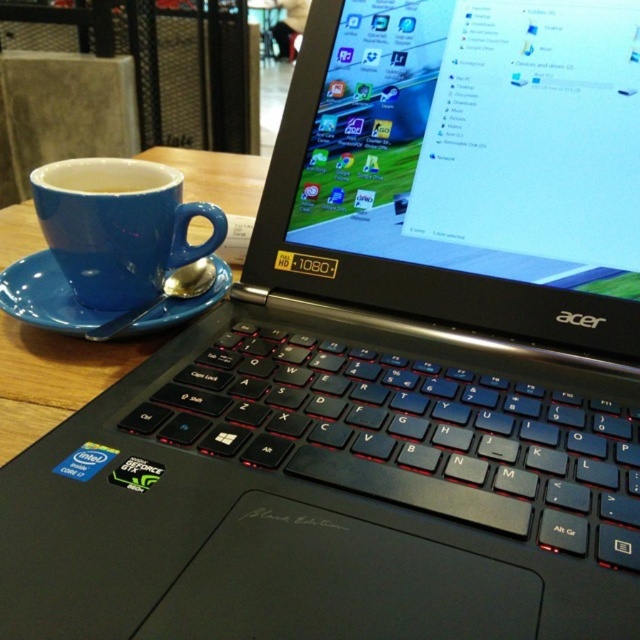
You are setting up a presentation and need to ensure your laptop is centered on the table. The laptop is currently positioned to the right of the matte blue mug at left. Based on the coordinates provided in the description, can you determine if the laptop is centered relative to the table?

The matte blue mug at left is located at point (118, 227). Since the laptop is positioned to the right of the mug, it is not centered on the table as the mug is closer to the left edge of the table. Therefore, the laptop is likely off to the right side and not centered.

You are organizing a small table for a meeting. You have a blue ceramic cup at left and a blue matte saucer at left. Which item is taller?

The blue ceramic cup at left is much taller than the blue matte saucer at left.

Based on the photo, you are organizing a coffee station and need to stack the matte blue mug at left and the blue ceramic cup at left. Which one should you place at the bottom to prevent them from toppling over?

The matte blue mug at left has a lesser height compared to the blue ceramic cup at left, so placing the taller blue ceramic cup at left at the bottom would provide a more stable base for the stack.